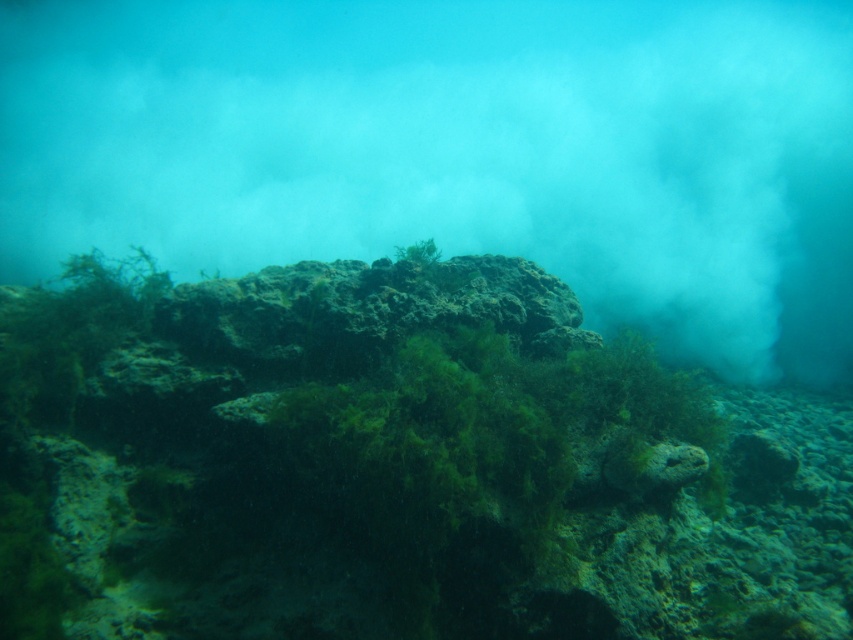
You are a marine biologist diving in the underwater scene. You want to take a photo of the point at coordinates point (115,497). The camera you are using has a maximum focus range of 10 feet. Will you be able to capture the point clearly without moving closer?

The point at coordinates point (115,497) is 9.25 feet away from the camera, which is within the maximum focus range of 10 feet. Therefore, you can capture the point clearly without moving closer.